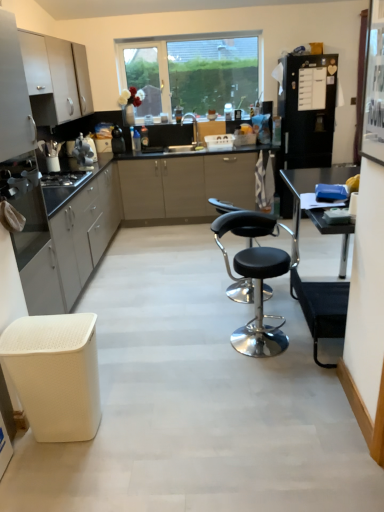
Question: Considering the positions of point pyautogui.click(x=57, y=76) and point pyautogui.click(x=49, y=327), is point pyautogui.click(x=57, y=76) closer or farther from the camera than point pyautogui.click(x=49, y=327)?

Choices:
 (A) farther
 (B) closer

Answer: (A)

Question: Based on their sizes in the image, would you say satin white cabinets at left, the 4th cabinetry when ordered from bottom to top, is bigger or smaller than white textured stool at lower left?

Choices:
 (A) big
 (B) small

Answer: (A)

Question: Estimate the real-world distances between objects in this image. Which object is closer to the satin silver toaster at left, arranged as the first appliance when viewed from the front?

Choices:
 (A) matte white cabinets at left, which appears as the 4th cabinetry when viewed from the top
 (B) transparent glass door at upper right
 (C) matte black gas stove at left
 (D) metallic silver toaster at left
 (E) white textured stool at lower left

Answer: (C)

Question: Estimate the real-world distances between objects in this image. Which object is closer to the metallic silver toaster at left?

Choices:
 (A) black leather stool at center, placed as the second chair when sorted from back to front
 (B) white matte cabinet at upper left, the 2th cabinetry from the top
 (C) satin white cabinets at left, which appears as the first cabinetry when viewed from the top
 (D) black leather stool at center, the 1th chair positioned from the back
 (E) satin silver toaster at left, arranged as the first appliance when viewed from the front

Answer: (B)